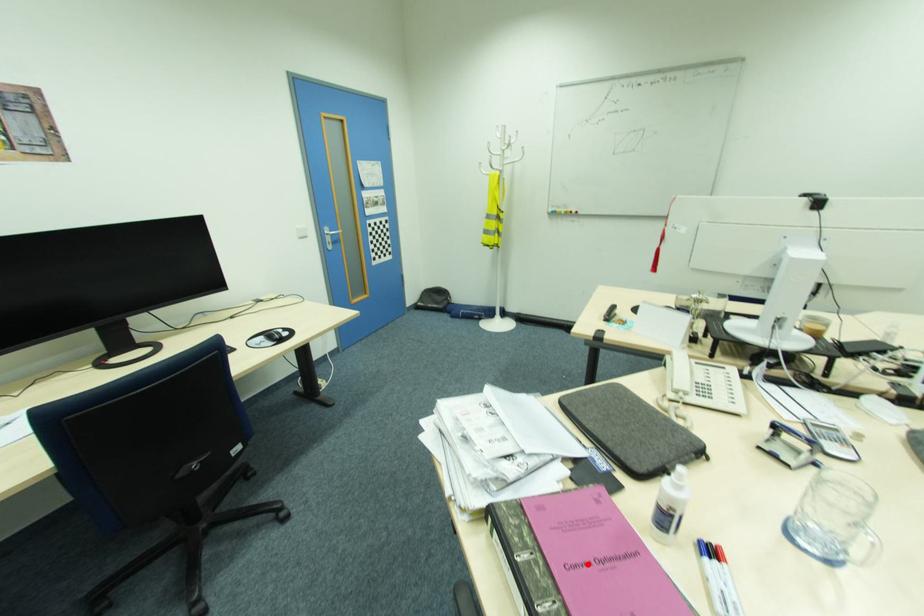
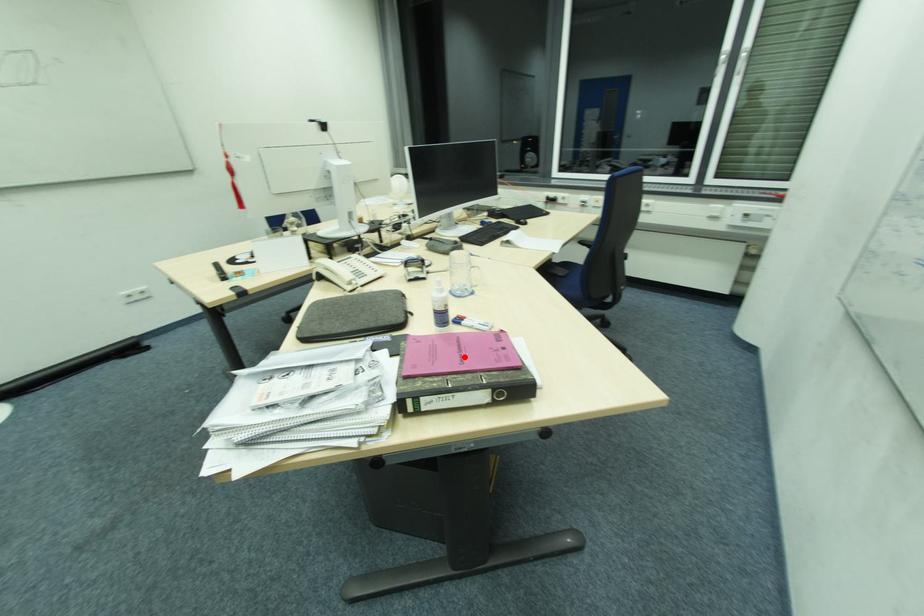
I am providing you with two images of the same scene from different viewpoints. A red point is marked on the first image and another point is marked on the second image. Does the point marked in image1 correspond to the same location as the one in image2?

Yes